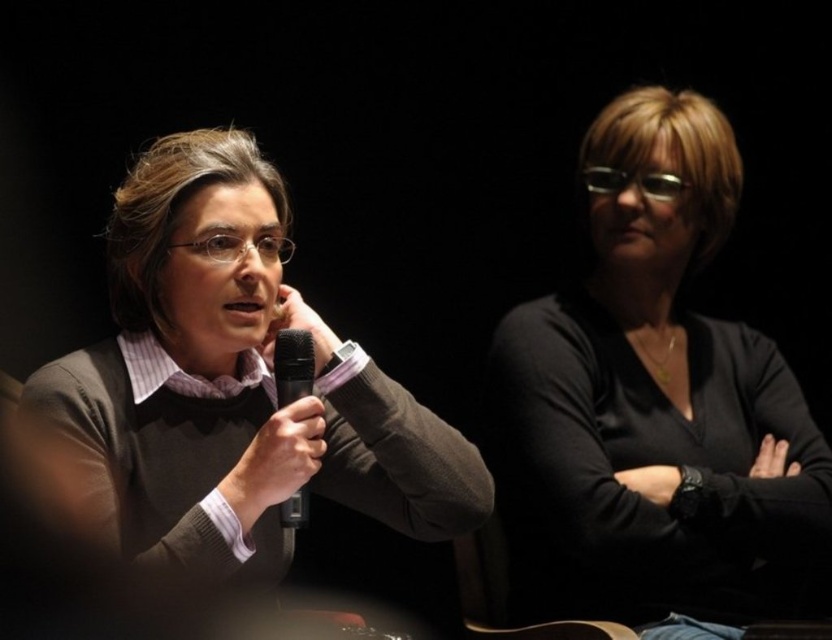
Between black matte shirt at upper right and matte gray sweater at left, which one is positioned lower?

matte gray sweater at left is below.

At what (x,y) coordinates should I click in order to perform the action: click on black matte shirt at upper right. Please return your answer as a coordinate pair (x, y). Looking at the image, I should click on (659, 400).

The height and width of the screenshot is (640, 832). I want to click on black matte shirt at upper right, so click(659, 400).

Is black matte shirt at upper right closer to camera compared to black matte microphone at center?

No, black matte shirt at upper right is further to the viewer.

Identify the location of black matte shirt at upper right. (659, 400).

At what (x,y) coordinates should I click in order to perform the action: click on black matte shirt at upper right. Please return your answer as a coordinate pair (x, y). Looking at the image, I should click on (659, 400).

Who is shorter, matte gray sweater at left or black matte microphone at center?

black matte microphone at center is shorter.

Between point (404, 448) and point (273, 356), which one is positioned in front?

Point (273, 356) is in front.

You are a GUI agent. You are given a task and a screenshot of the screen. Output one action in this format:
    pyautogui.click(x=<x>, y=<y>)
    Task: Click on the matte gray sweater at left
    The height and width of the screenshot is (640, 832).
    Given the screenshot: What is the action you would take?
    pyautogui.click(x=234, y=385)